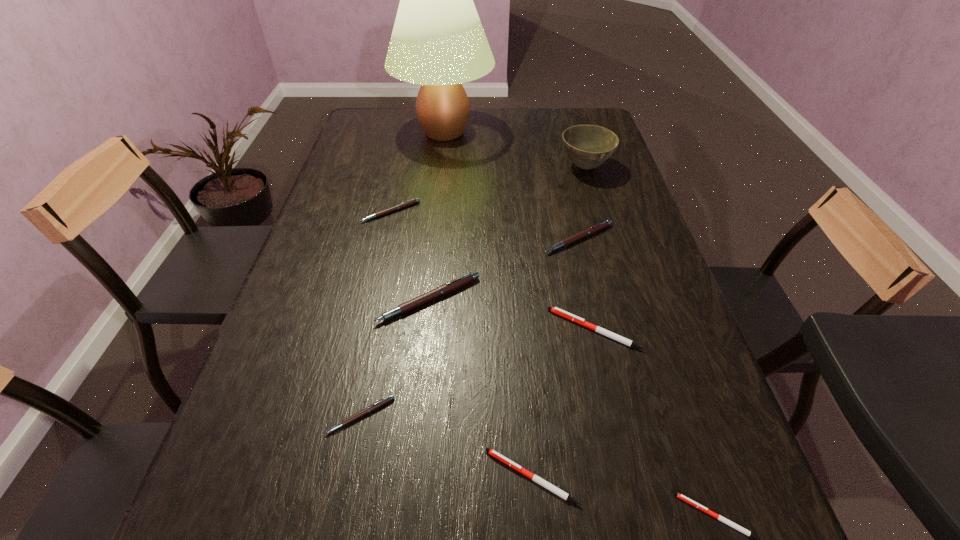
I want to click on object identified as the second closest to the tallest pen, so click(374, 406).

Select which object appears as the fifth closest to the biggest pink pen. Please provide its 2D coordinates. Your answer should be formatted as a tuple, i.e. [(x, y)], where the tuple contains the x and y coordinates of a point satisfying the conditions above.

[(534, 477)]

Choose which pen is the fourth nearest neighbor to the second biggest white pen. Please provide its 2D coordinates. Your answer should be formatted as a tuple, i.e. [(x, y)], where the tuple contains the x and y coordinates of a point satisfying the conditions above.

[(452, 285)]

Identify which pen is the closest to the shortest pen. Please provide its 2D coordinates. Your answer should be formatted as a tuple, i.e. [(x, y)], where the tuple contains the x and y coordinates of a point satisfying the conditions above.

[(534, 477)]

I want to click on pink pen that is the nearest to the smallest pink pen, so click(452, 285).

Where is `pink pen that is the third closest to the eighth shortest object`? Image resolution: width=960 pixels, height=540 pixels. pink pen that is the third closest to the eighth shortest object is located at coordinates (452, 285).

What are the coordinates of `white pen that is the second closest to the shortest pen` in the screenshot? It's located at (567, 315).

Identify which white pen is the closest to the second biggest white pen. Please provide its 2D coordinates. Your answer should be formatted as a tuple, i.e. [(x, y)], where the tuple contains the x and y coordinates of a point satisfying the conditions above.

[(680, 496)]